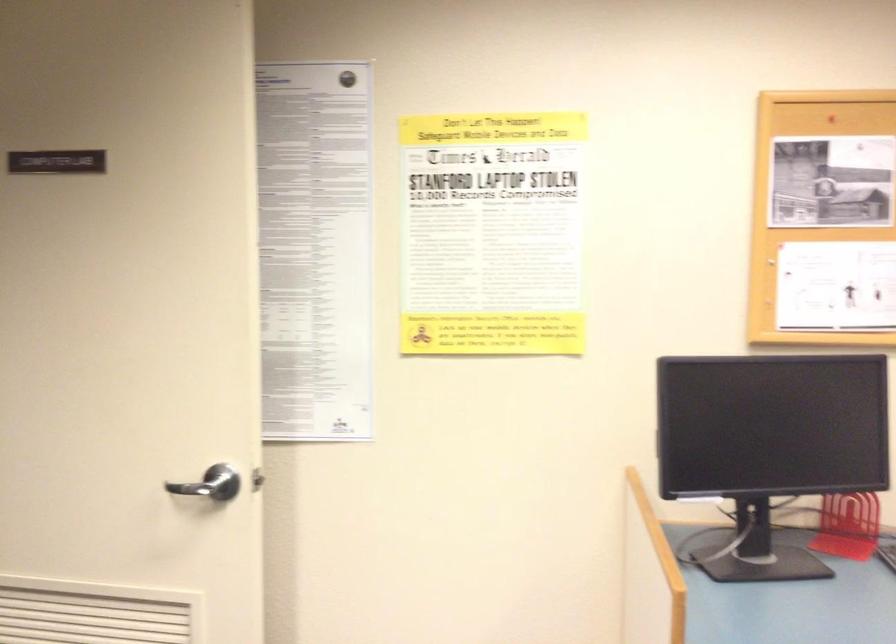
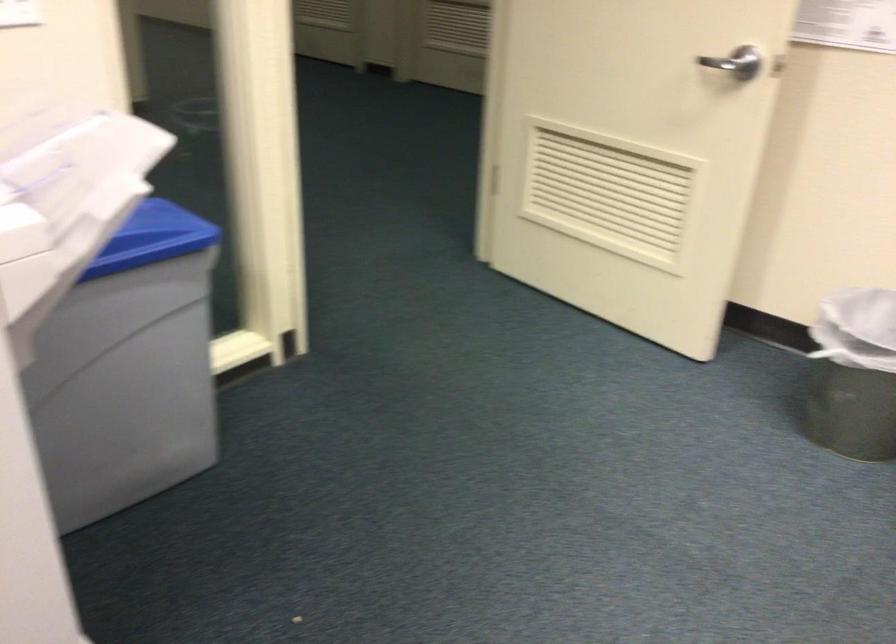
First-person continuous shooting, in which direction is the camera rotating?

The rotation direction of the camera is left-down.